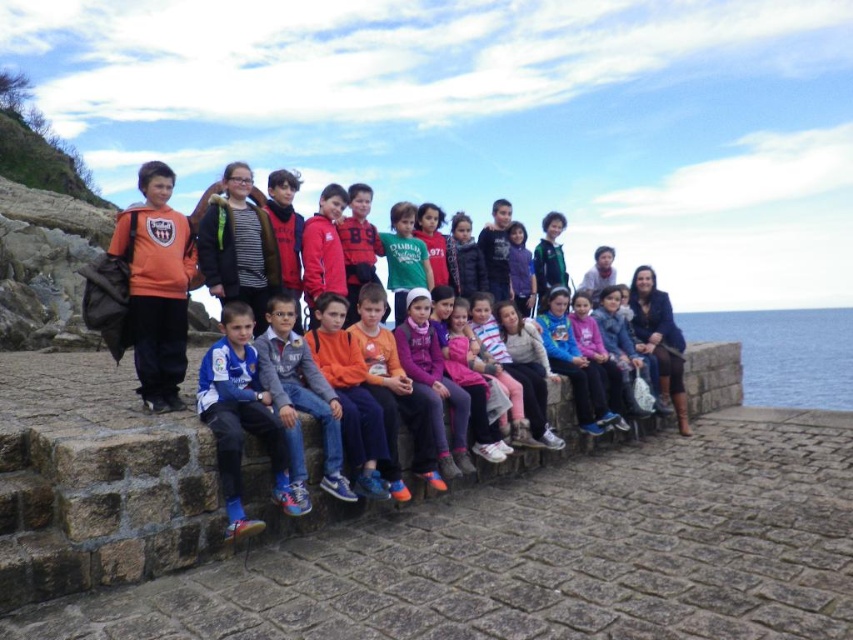
Does orange fleece jacket at left appear on the left side of blue water at lower right?

Correct, you'll find orange fleece jacket at left to the left of blue water at lower right.

Who is shorter, orange fleece jacket at left or blue water at lower right?

With less height is orange fleece jacket at left.

Who is more distant from viewer, (181, 289) or (808, 312)?

The point (808, 312) is more distant.

What are the coordinates of `orange fleece jacket at left` in the screenshot? It's located at (157, 285).